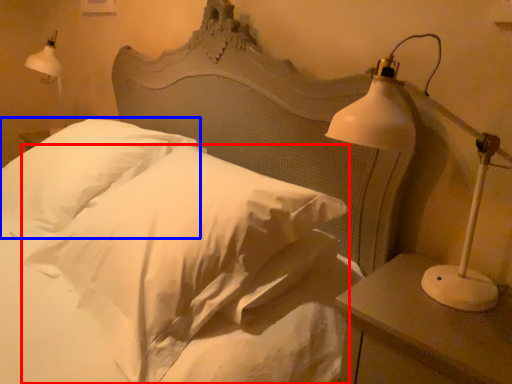
Question: Which of the following is the farthest to the observer, pillow (highlighted by a red box) or pillow (highlighted by a blue box)?

Choices:
 (A) pillow
 (B) pillow

Answer: (B)